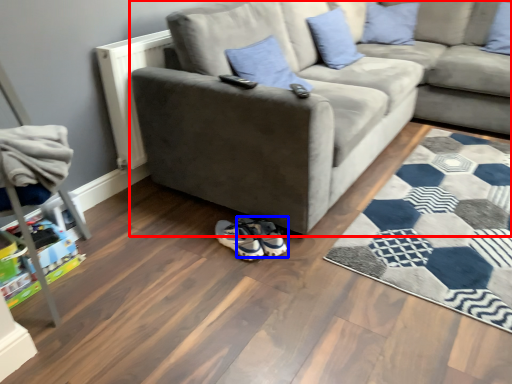
Question: Among these objects, which one is nearest to the camera, studio couch (highlighted by a red box) or footwear (highlighted by a blue box)?

Choices:
 (A) studio couch
 (B) footwear

Answer: (A)